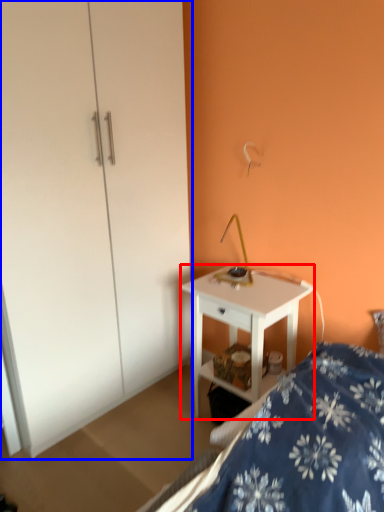
Question: Which point is closer to the camera, desk (highlighted by a red box) or dresser (highlighted by a blue box)?

Choices:
 (A) desk
 (B) dresser

Answer: (B)